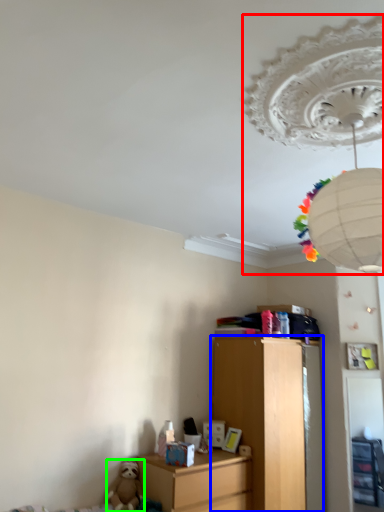
Question: Estimate the real-world distances between objects in this image. Which object is closer to lamp (highlighted by a red box), chest of drawers (highlighted by a blue box) or toy (highlighted by a green box)?

Choices:
 (A) chest of drawers
 (B) toy

Answer: (A)